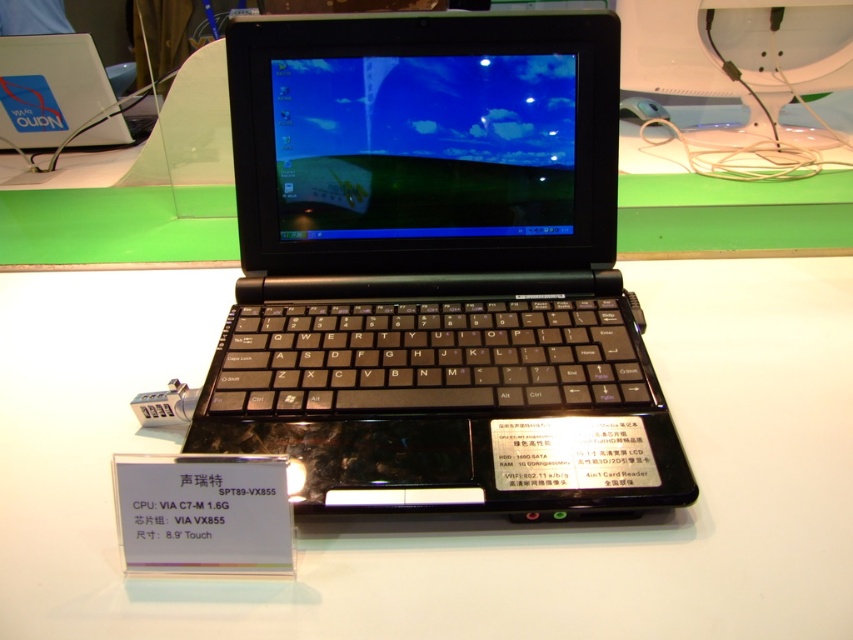
Does black plastic laptop at center have a greater height compared to black plastic table at center?

Yes, black plastic laptop at center is taller than black plastic table at center.

Is point (520, 509) positioned before point (842, 445)?

Yes.

In order to click on black plastic laptop at center in this screenshot , I will do `click(430, 257)`.